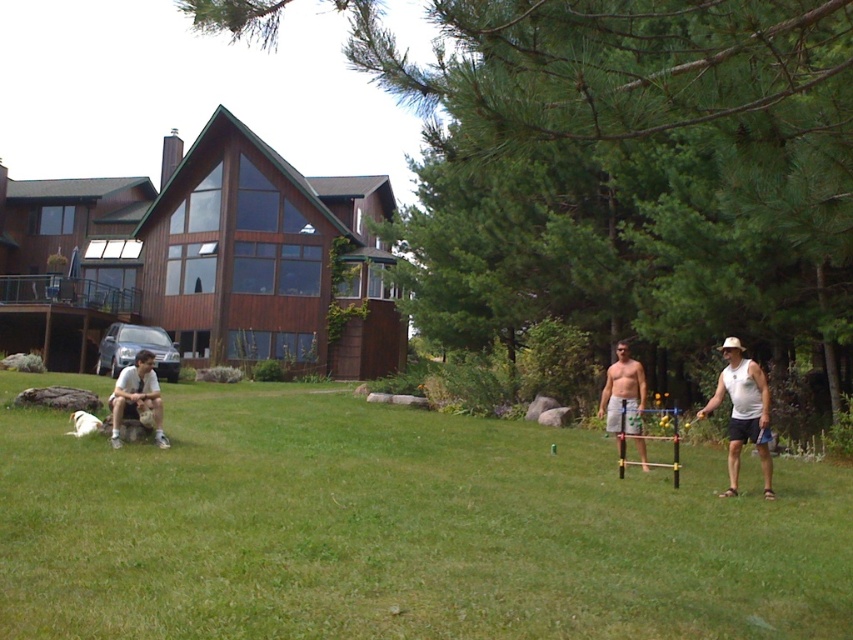
Is green grass at lower center to the right of light brown fabric shirt at left from the viewer's perspective?

Indeed, green grass at lower center is positioned on the right side of light brown fabric shirt at left.

Does green grass at lower center appear over light brown fabric shirt at left?

No, green grass at lower center is not above light brown fabric shirt at left.

Between point (740, 547) and point (151, 376), which one is positioned behind?

The point (151, 376) is behind.

You are a GUI agent. You are given a task and a screenshot of the screen. Output one action in this format:
    pyautogui.click(x=<x>, y=<y>)
    Task: Click on the green grass at lower center
    This screenshot has width=853, height=640.
    Given the screenshot: What is the action you would take?
    pyautogui.click(x=399, y=529)

Does point (641, 616) come behind point (734, 410)?

No, (641, 616) is closer to viewer.

This screenshot has height=640, width=853. Find the location of `green grass at lower center`. green grass at lower center is located at coordinates (399, 529).

Is green grass at lower center bigger than shiny silver shorts at center?

Correct, green grass at lower center is larger in size than shiny silver shorts at center.

What are the coordinates of `green grass at lower center` in the screenshot? It's located at (399, 529).